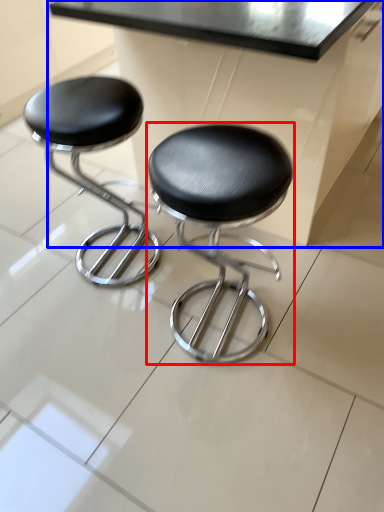
Question: Which object appears farthest to the camera in this image, stool (highlighted by a red box) or table (highlighted by a blue box)?

Choices:
 (A) stool
 (B) table

Answer: (B)